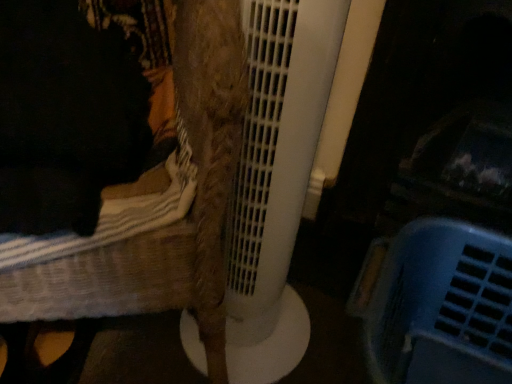
Question: From the image's perspective, relative to woven fabric chair at left, is blue plastic basket at lower right above or below?

Choices:
 (A) below
 (B) above

Answer: (A)

Question: Looking at their shapes, would you say blue plastic basket at lower right is wider or thinner than woven fabric chair at left?

Choices:
 (A) thin
 (B) wide

Answer: (A)

Question: From their relative heights in the image, would you say blue plastic basket at lower right is taller or shorter than woven fabric chair at left?

Choices:
 (A) tall
 (B) short

Answer: (B)

Question: Considering the positions of woven fabric chair at left and blue plastic basket at lower right in the image, is woven fabric chair at left bigger or smaller than blue plastic basket at lower right?

Choices:
 (A) small
 (B) big

Answer: (B)

Question: Is woven fabric chair at left situated inside blue plastic basket at lower right or outside?

Choices:
 (A) outside
 (B) inside

Answer: (A)

Question: From a real-world perspective, is woven fabric chair at left above or below blue plastic basket at lower right?

Choices:
 (A) above
 (B) below

Answer: (A)

Question: From the image's perspective, is woven fabric chair at left above or below blue plastic basket at lower right?

Choices:
 (A) below
 (B) above

Answer: (B)